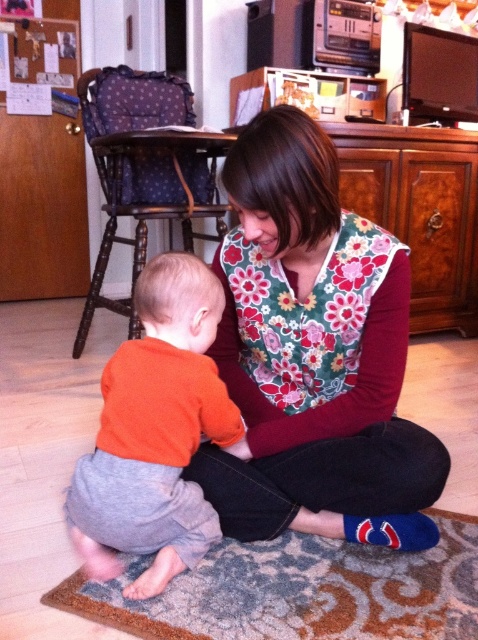
Question: Is floral fabric shirt at center below orange cotton shirt at lower left?

Choices:
 (A) no
 (B) yes

Answer: (A)

Question: Estimate the real-world distances between objects in this image. Which object is closer to the floral fabric shirt at center?

Choices:
 (A) orange cotton shirt at lower left
 (B) blue fuzzy socks at lower center

Answer: (B)

Question: Can you confirm if floral fabric shirt at center is positioned below blue fuzzy socks at lower center?

Choices:
 (A) yes
 (B) no

Answer: (B)

Question: Does floral fabric shirt at center appear on the right side of orange cotton shirt at lower left?

Choices:
 (A) no
 (B) yes

Answer: (B)

Question: Which of the following is the farthest from the observer?

Choices:
 (A) (351, 476)
 (B) (180, 356)

Answer: (A)

Question: Which object appears closest to the camera in this image?

Choices:
 (A) blue fuzzy socks at lower center
 (B) orange cotton shirt at lower left

Answer: (B)